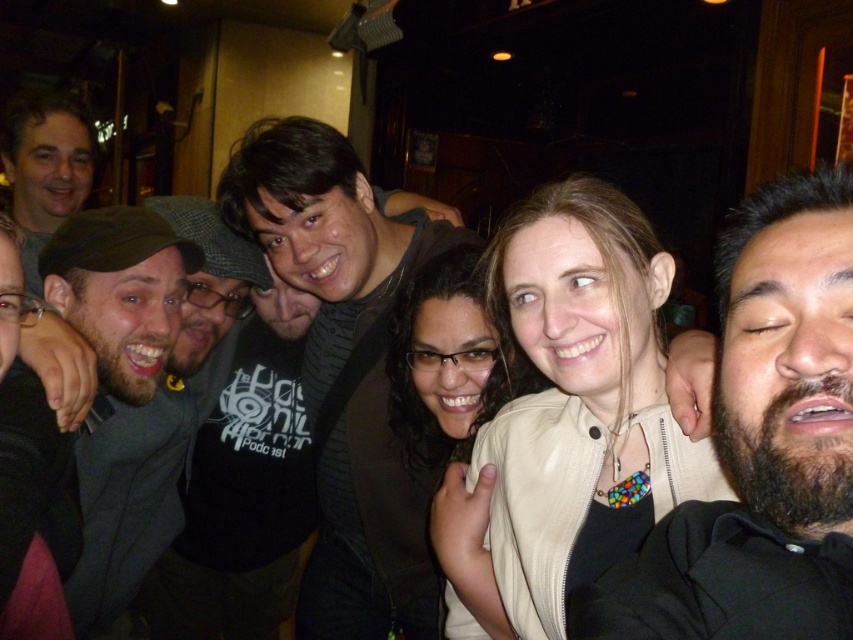
Which is behind, point (556, 186) or point (721, 266)?

The point (556, 186) is behind.

Is point (543, 532) farther from camera compared to point (764, 429)?

Yes, point (543, 532) is behind point (764, 429).

The height and width of the screenshot is (640, 853). Find the location of `light beige leather jacket at center`. light beige leather jacket at center is located at coordinates (569, 410).

Between point (512, 419) and point (329, 529), which one is positioned behind?

Point (329, 529)

Who is taller, light beige leather jacket at center or dark gray sweater at center?

dark gray sweater at center

Is point (628, 504) in front of point (374, 611)?

Yes, point (628, 504) is in front of point (374, 611).

I want to click on light beige leather jacket at center, so click(569, 410).

Does dark gray sweater at center have a lesser height compared to dark green fabric shirt at left?

No, dark gray sweater at center is not shorter than dark green fabric shirt at left.

From the picture: Measure the distance from dark gray sweater at center to dark green fabric shirt at left.

dark gray sweater at center is 32.02 centimeters away from dark green fabric shirt at left.

I want to click on dark gray sweater at center, so click(344, 371).

In order to click on dark gray sweater at center in this screenshot , I will do `click(344, 371)`.